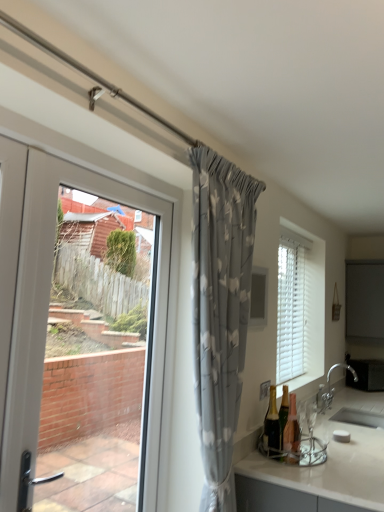
Question: From the image's perspective, does clear glass window screen at upper center appear higher than shiny gold bottle at lower right, acting as the second bottle starting from the right?

Choices:
 (A) no
 (B) yes

Answer: (B)

Question: Is clear glass window screen at upper center closer to camera compared to shiny gold bottle at lower right, acting as the second bottle starting from the right?

Choices:
 (A) yes
 (B) no

Answer: (B)

Question: Is clear glass window screen at upper center facing towards shiny gold bottle at lower right, acting as the second bottle starting from the right?

Choices:
 (A) yes
 (B) no

Answer: (B)

Question: Does clear glass window screen at upper center have a greater height compared to shiny gold bottle at lower right, acting as the second bottle starting from the right?

Choices:
 (A) yes
 (B) no

Answer: (A)

Question: Does clear glass window screen at upper center have a greater width compared to shiny gold bottle at lower right, which ranks as the 1th bottle in left-to-right order?

Choices:
 (A) yes
 (B) no

Answer: (B)

Question: Is clear glass window screen at upper center at the right side of shiny gold bottle at lower right, acting as the second bottle starting from the right?

Choices:
 (A) yes
 (B) no

Answer: (B)

Question: From the image's perspective, does white plastic door at left appear lower than white glossy countertop at lower right?

Choices:
 (A) no
 (B) yes

Answer: (A)

Question: From the image's perspective, is white plastic door at left located above white glossy countertop at lower right?

Choices:
 (A) yes
 (B) no

Answer: (A)

Question: Does white plastic door at left come in front of white glossy countertop at lower right?

Choices:
 (A) yes
 (B) no

Answer: (A)

Question: Does white plastic door at left turn towards white glossy countertop at lower right?

Choices:
 (A) no
 (B) yes

Answer: (A)

Question: Is white plastic door at left taller than white glossy countertop at lower right?

Choices:
 (A) no
 (B) yes

Answer: (B)

Question: From a real-world perspective, is white plastic door at left positioned under white glossy countertop at lower right based on gravity?

Choices:
 (A) no
 (B) yes

Answer: (A)

Question: Is silver metallic faucet at lower right smaller than matte glass bottle at lower right, which is the 2th bottle in left-to-right order?

Choices:
 (A) no
 (B) yes

Answer: (A)